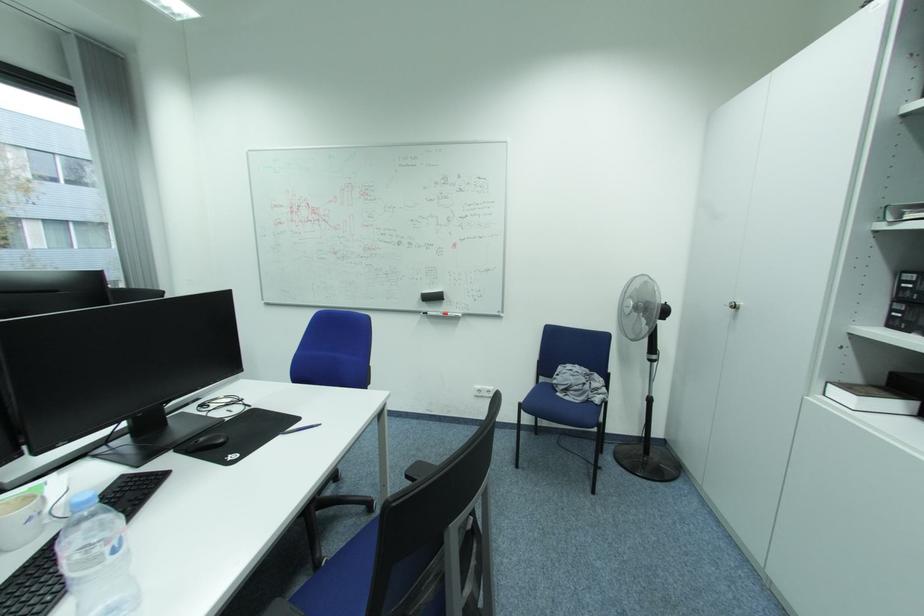
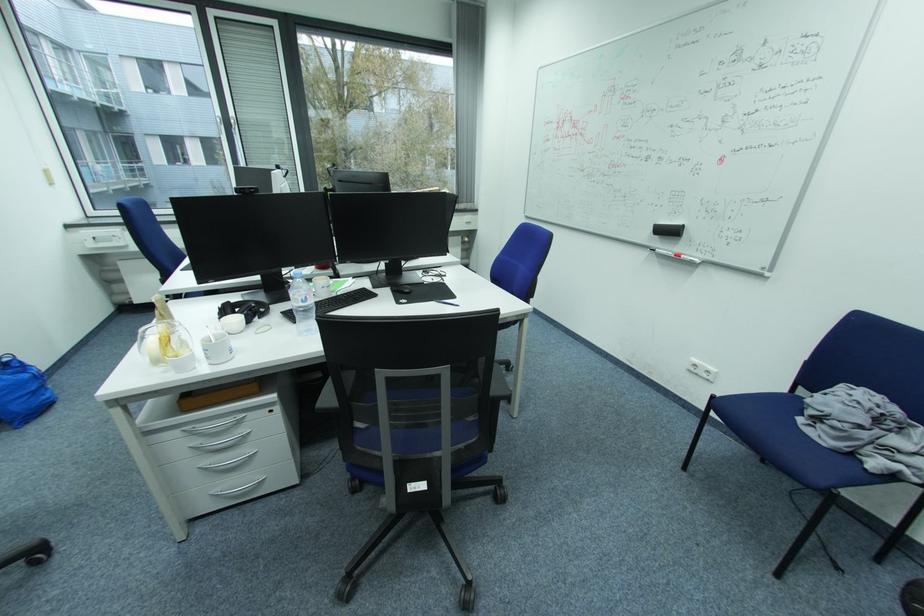
Find the pixel in the second image that matches pixel 443 299 in the first image.

(677, 233)